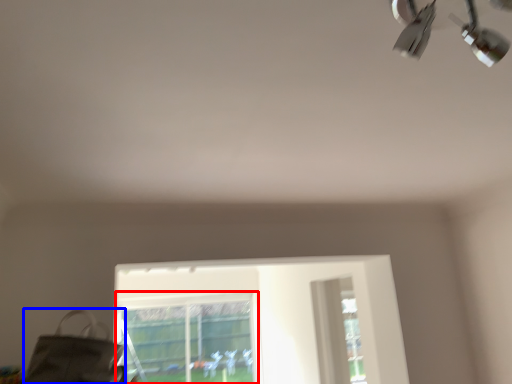
Question: Which object is further to the camera taking this photo, bay window (highlighted by a red box) or messenger bag (highlighted by a blue box)?

Choices:
 (A) bay window
 (B) messenger bag

Answer: (A)